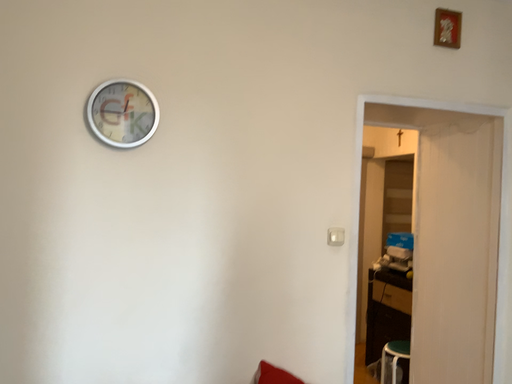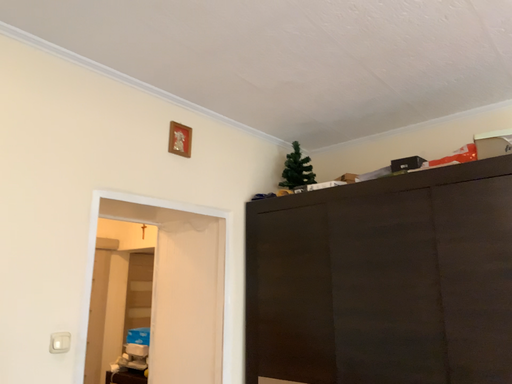
Question: Which way did the camera rotate in the video?

Choices:
 (A) rotated upward
 (B) rotated downward

Answer: (A)